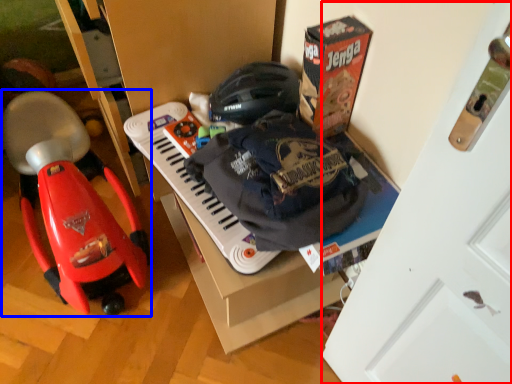
Question: Which object appears closest to the camera in this image, door (highlighted by a red box) or baby carriage (highlighted by a blue box)?

Choices:
 (A) door
 (B) baby carriage

Answer: (A)